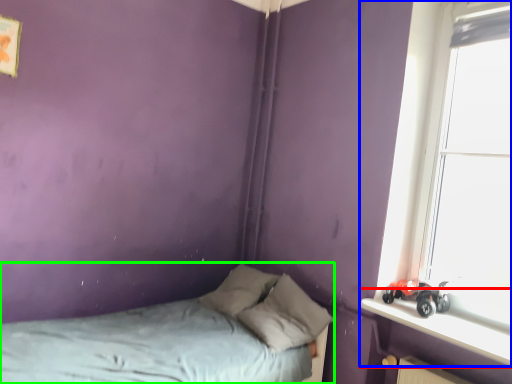
Question: Estimate the real-world distances between objects in this image. Which object is closer to window sill (highlighted by a red box), window (highlighted by a blue box) or bed (highlighted by a green box)?

Choices:
 (A) window
 (B) bed

Answer: (A)